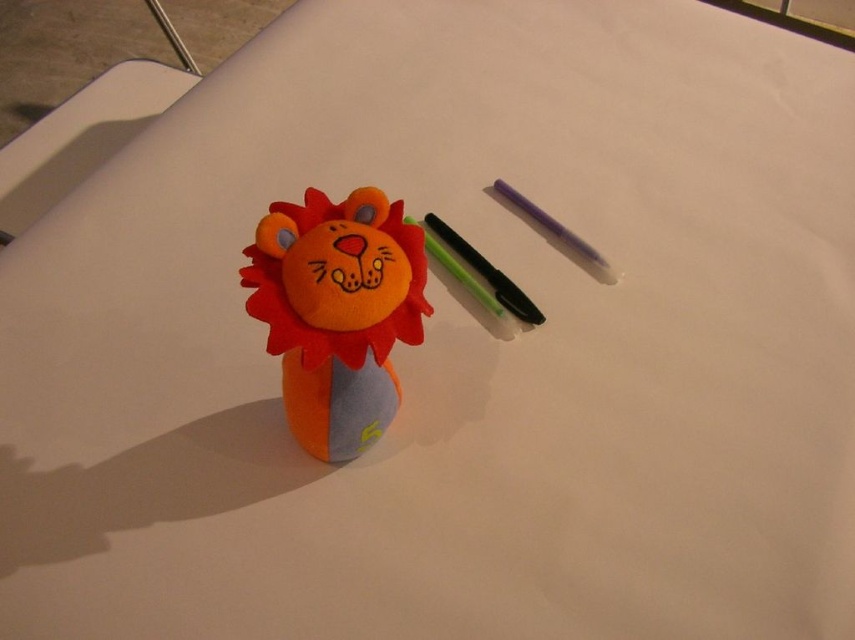
Question: Which of the following is the farthest from the observer?

Choices:
 (A) (338, 403)
 (B) (498, 285)

Answer: (B)

Question: Is soft plush lion at center closer to camera compared to black glossy pen at center?

Choices:
 (A) no
 (B) yes

Answer: (B)

Question: Can you confirm if soft plush lion at center is thinner than black glossy pen at center?

Choices:
 (A) yes
 (B) no

Answer: (B)

Question: Which point is farther to the camera?

Choices:
 (A) (337, 452)
 (B) (472, 259)

Answer: (B)

Question: Can you confirm if soft plush lion at center is positioned below black glossy pen at center?

Choices:
 (A) no
 (B) yes

Answer: (B)

Question: Which point is farther to the camera?

Choices:
 (A) soft plush lion at center
 (B) black glossy pen at center

Answer: (B)